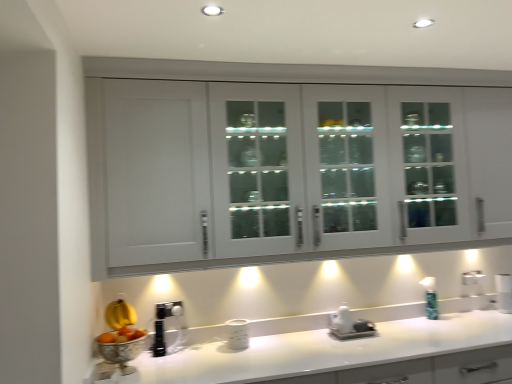
At what (x,y) coordinates should I click in order to perform the action: click on green glass soap dispenser at right. Please return your answer as a coordinate pair (x, y). Looking at the image, I should click on (430, 297).

Locate an element on the screen. white glossy countertop at lower center is located at coordinates (315, 348).

I want to click on green glass soap dispenser at right, so click(x=430, y=297).

Considering the positions of objects green glass soap dispenser at right and white glossy countertop at lower center in the image provided, who is more to the right, green glass soap dispenser at right or white glossy countertop at lower center?

green glass soap dispenser at right.

The height and width of the screenshot is (384, 512). I want to click on countertop located underneath the green glass soap dispenser at right (from a real-world perspective), so click(315, 348).

Is green glass soap dispenser at right facing away from white glossy countertop at lower center?

No, white glossy countertop at lower center is not at the back of green glass soap dispenser at right.

From a real-world perspective, which is physically below, green glass soap dispenser at right or white glossy countertop at lower center?

From a 3D spatial view, white glossy countertop at lower center is below.

Who is bigger, green glass soap dispenser at right or white glossy cabinet at upper center?

Bigger between the two is white glossy cabinet at upper center.

From the image's perspective, relative to white glossy cabinet at upper center, is green glass soap dispenser at right above or below?

green glass soap dispenser at right is below white glossy cabinet at upper center.

What's the angular difference between green glass soap dispenser at right and white glossy cabinet at upper center's facing directions?

There is a 4.18-degree angle between the facing directions of green glass soap dispenser at right and white glossy cabinet at upper center.

Where is `cabinetry on the left of white glossy countertop at lower center`? cabinetry on the left of white glossy countertop at lower center is located at coordinates (289, 171).

Does point (298, 348) lie behind point (341, 250)?

That is False.

Is the position of white glossy countertop at lower center less distant than that of white glossy cabinet at upper center?

That is True.

Between white glossy cabinet at upper center and green glass soap dispenser at right, which one has less height?

Standing shorter between the two is green glass soap dispenser at right.

The width and height of the screenshot is (512, 384). I want to click on soap dispenser that appears behind the white glossy cabinet at upper center, so click(430, 297).

Which object is positioned more to the left, white glossy cabinet at upper center or green glass soap dispenser at right?

white glossy cabinet at upper center.

Is white glossy cabinet at upper center further to the viewer compared to green glass soap dispenser at right?

No, white glossy cabinet at upper center is closer to the viewer.

Is white glossy cabinet at upper center not near white glossy countertop at lower center?

They are positioned close to each other.

Is white glossy cabinet at upper center thinner than white glossy countertop at lower center?

Yes.

Is white glossy cabinet at upper center oriented away from white glossy countertop at lower center?

No, white glossy cabinet at upper center's orientation is not away from white glossy countertop at lower center.

Which point is more forward, [239,216] or [395,306]?

The point [239,216] is closer.

Is white glossy countertop at lower center oriented away from green glass soap dispenser at right?

white glossy countertop at lower center does not have its back to green glass soap dispenser at right.

Visually, is white glossy countertop at lower center positioned to the left or to the right of green glass soap dispenser at right?

white glossy countertop at lower center is to the left of green glass soap dispenser at right.

Between white glossy countertop at lower center and green glass soap dispenser at right, which one has more height?

Standing taller between the two is white glossy countertop at lower center.

Identify the location of soap dispenser above the white glossy countertop at lower center (from the image's perspective). (430, 297).

The height and width of the screenshot is (384, 512). Identify the location of soap dispenser located underneath the white glossy cabinet at upper center (from a real-world perspective). (430, 297).

Considering their positions, is white glossy cabinet at upper center positioned further to green glass soap dispenser at right than white glossy countertop at lower center?

Based on the image, white glossy cabinet at upper center appears to be further to green glass soap dispenser at right.

From the image, which object appears to be farther from green glass soap dispenser at right, white glossy countertop at lower center or white glossy cabinet at upper center?

white glossy cabinet at upper center is positioned further to the anchor green glass soap dispenser at right.

Consider the image. Which object lies nearer to the anchor point white glossy cabinet at upper center, white glossy countertop at lower center or green glass soap dispenser at right?

The object closer to white glossy cabinet at upper center is white glossy countertop at lower center.

Considering their positions, is green glass soap dispenser at right positioned further to white glossy cabinet at upper center than white glossy countertop at lower center?

green glass soap dispenser at right is further to white glossy cabinet at upper center.

Which object lies further to the anchor point white glossy countertop at lower center, green glass soap dispenser at right or white glossy cabinet at upper center?

white glossy cabinet at upper center lies further to white glossy countertop at lower center than the other object.

Estimate the real-world distances between objects in this image. Which object is further from white glossy countertop at lower center, white glossy cabinet at upper center or green glass soap dispenser at right?

white glossy cabinet at upper center.

The width and height of the screenshot is (512, 384). Identify the location of soap dispenser between white glossy cabinet at upper center and white glossy countertop at lower center from top to bottom. (430, 297).